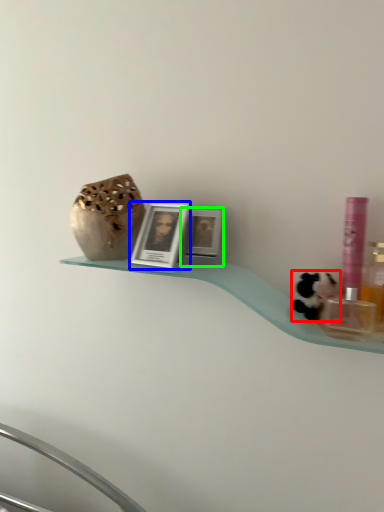
Question: Which object is positioned closest to animal (highlighted by a red box)? Select from picture frame (highlighted by a blue box) and picture frame (highlighted by a green box).

Choices:
 (A) picture frame
 (B) picture frame

Answer: (B)